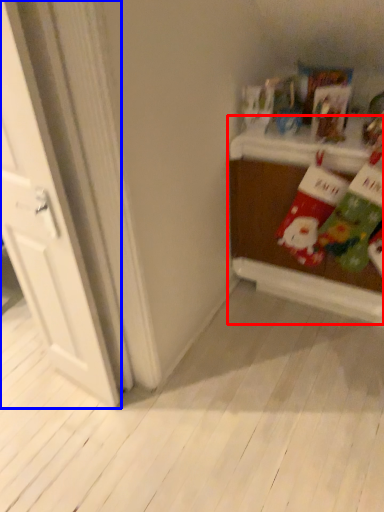
Question: Which object appears closest to the camera in this image, table (highlighted by a red box) or door (highlighted by a blue box)?

Choices:
 (A) table
 (B) door

Answer: (B)